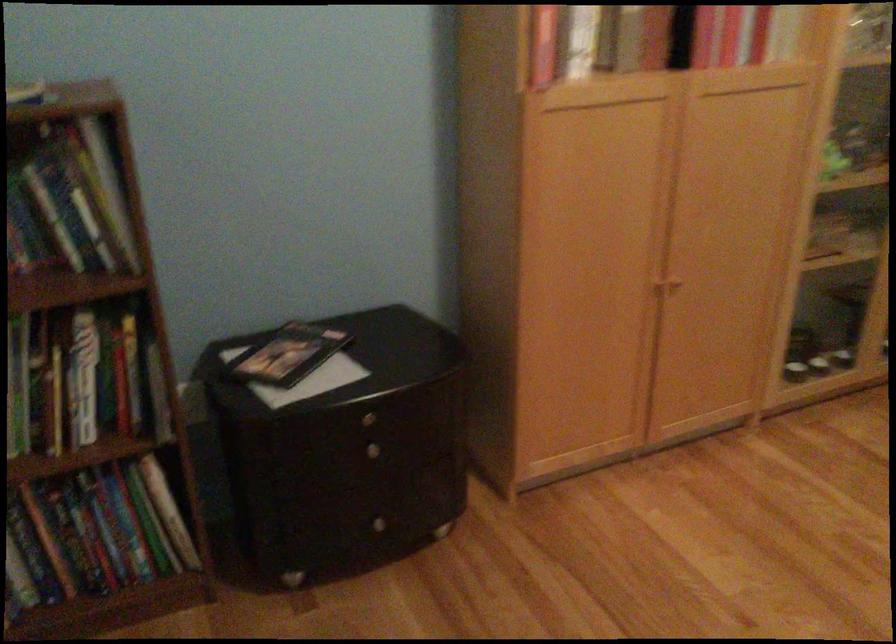
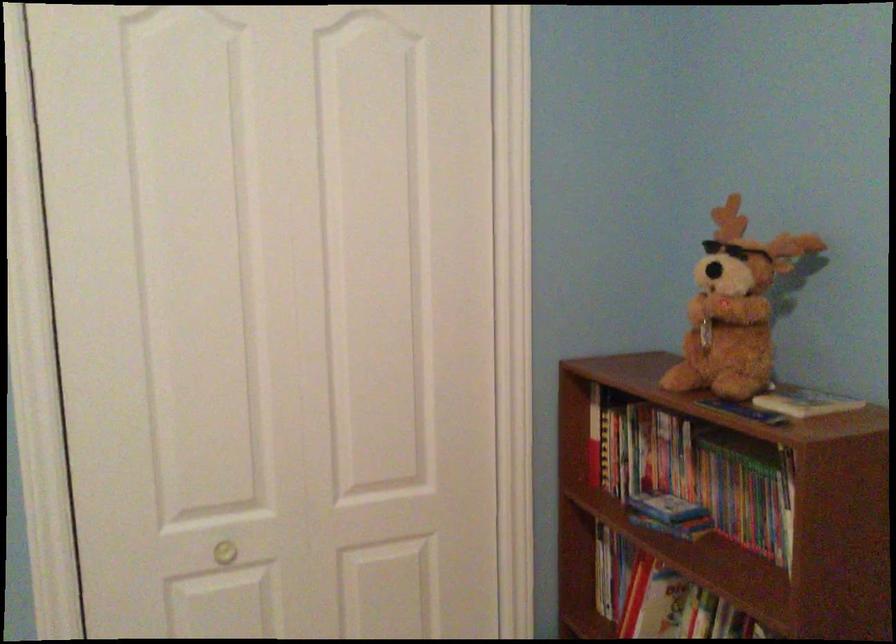
Question: The camera is either moving clockwise (left) or counter-clockwise (right) around the object. The first image is from the beginning of the video and the second image is from the end. Is the camera moving left or right when shooting the video?

Choices:
 (A) Left
 (B) Right

Answer: (B)